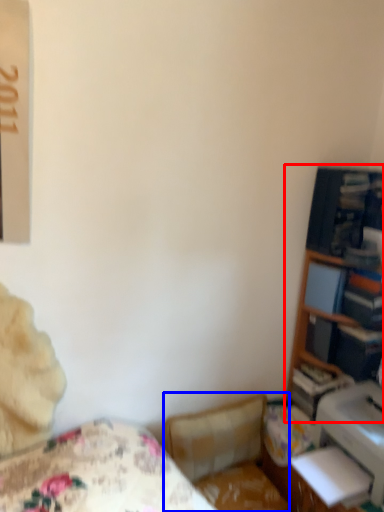
Question: Which point is closer to the camera, bookshelf (highlighted by a red box) or swivel chair (highlighted by a blue box)?

Choices:
 (A) bookshelf
 (B) swivel chair

Answer: (B)